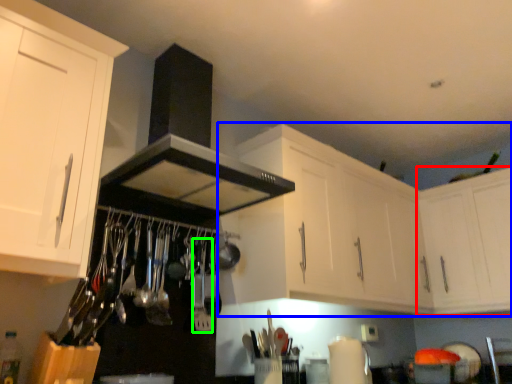
Question: Which is nearer to the cabinetry (highlighted by a red box)? cabinetry (highlighted by a blue box) or silverware (highlighted by a green box).

Choices:
 (A) cabinetry
 (B) silverware

Answer: (A)